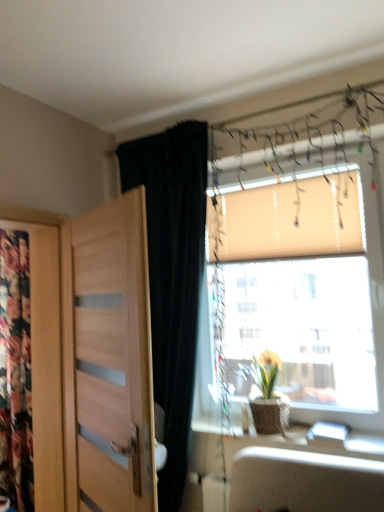
The height and width of the screenshot is (512, 384). I want to click on beige fabric blind at upper right, so [x=291, y=221].

Image resolution: width=384 pixels, height=512 pixels. Describe the element at coordinates (108, 360) in the screenshot. I see `light brown wood door at left` at that location.

Where is `beige fabric blind at upper right`? Image resolution: width=384 pixels, height=512 pixels. beige fabric blind at upper right is located at coordinates (291, 221).

Considering the sizes of objects green leafy plant in woven basket at window and floral fabric at left in the image provided, who is wider, green leafy plant in woven basket at window or floral fabric at left?

With larger width is green leafy plant in woven basket at window.

Is green leafy plant in woven basket at window in contact with floral fabric at left?

No, green leafy plant in woven basket at window is not in contact with floral fabric at left.

Considering the relative sizes of green leafy plant in woven basket at window and floral fabric at left in the image provided, is green leafy plant in woven basket at window shorter than floral fabric at left?

Correct, green leafy plant in woven basket at window is not as tall as floral fabric at left.

From the picture: Which is nearer, [279,406] or [22,384]?

Point [279,406] appears to be closer to the viewer than point [22,384].

Which of these two, floral fabric at left or beige fabric blind at upper right, stands taller?

floral fabric at left.

Would you say beige fabric blind at upper right is part of floral fabric at left's contents?

Actually, beige fabric blind at upper right is outside floral fabric at left.

Considering the points (20, 359) and (264, 258), which point is in front, point (20, 359) or point (264, 258)?

The point (264, 258) is closer.

From the image's perspective, is floral fabric at left positioned above or below wooden blinds at upper right?

floral fabric at left is below wooden blinds at upper right.

Does floral fabric at left contain wooden blinds at upper right?

Definitely not — wooden blinds at upper right is not inside floral fabric at left.

Considering their positions, is floral fabric at left located in front of or behind wooden blinds at upper right?

Visually, floral fabric at left is located behind wooden blinds at upper right.

From the image's perspective, is wooden blinds at upper right beneath light brown wood door at left?

Actually, wooden blinds at upper right appears above light brown wood door at left in the image.

Is wooden blinds at upper right touching light brown wood door at left?

No, wooden blinds at upper right is not next to light brown wood door at left.

Looking at this image, considering the sizes of objects wooden blinds at upper right and light brown wood door at left in the image provided, who is smaller, wooden blinds at upper right or light brown wood door at left?

light brown wood door at left.

From a real-world perspective, which is physically below, wooden blinds at upper right or light brown wood door at left?

light brown wood door at left, from a real-world perspective.

Does light brown wood door at left appear on the right side of black velvet curtain at left?

In fact, light brown wood door at left is to the left of black velvet curtain at left.

Does point (104, 359) appear closer or farther from the camera than point (170, 253)?

Clearly, point (104, 359) is closer to the camera than point (170, 253).

From the image's perspective, which one is positioned higher, light brown wood door at left or black velvet curtain at left?

black velvet curtain at left appears higher in the image.

Identify the location of door below the black velvet curtain at left (from a real-world perspective). Image resolution: width=384 pixels, height=512 pixels. (108, 360).

From a real-world perspective, between beige fabric blind at upper right and black velvet curtain at left, who is vertically higher?

beige fabric blind at upper right, from a real-world perspective.

Are beige fabric blind at upper right and black velvet curtain at left beside each other?

No, beige fabric blind at upper right is not in contact with black velvet curtain at left.

Would you say beige fabric blind at upper right contains black velvet curtain at left?

No, black velvet curtain at left is located outside of beige fabric blind at upper right.

Is beige fabric blind at upper right aimed at black velvet curtain at left?

No, beige fabric blind at upper right does not turn towards black velvet curtain at left.

Is light brown wood door at left located outside wooden blinds at upper right?

Yes, light brown wood door at left is not within wooden blinds at upper right.

Considering the sizes of objects light brown wood door at left and wooden blinds at upper right in the image provided, who is bigger, light brown wood door at left or wooden blinds at upper right?

wooden blinds at upper right is bigger.

From a real-world perspective, is light brown wood door at left under wooden blinds at upper right?

Yes.

Is light brown wood door at left aimed at wooden blinds at upper right?

No, light brown wood door at left is not facing towards wooden blinds at upper right.

This screenshot has width=384, height=512. I want to click on tapestry behind the green leafy plant in woven basket at window, so click(15, 372).

Where is `tapestry on the left of the beige fabric blind at upper right`? The width and height of the screenshot is (384, 512). tapestry on the left of the beige fabric blind at upper right is located at coordinates (15, 372).

When comparing their distances from beige fabric blind at upper right, does wooden blinds at upper right or black velvet curtain at left seem closer?

Among the two, wooden blinds at upper right is located nearer to beige fabric blind at upper right.

Which object lies further to the anchor point green leafy plant in woven basket at window, floral fabric at left or beige fabric blind at upper right?

Based on the image, floral fabric at left appears to be further to green leafy plant in woven basket at window.

When comparing their distances from black velvet curtain at left, does green leafy plant in woven basket at window or light brown wood door at left seem further?

green leafy plant in woven basket at window.

Consider the image. When comparing their distances from wooden blinds at upper right, does black velvet curtain at left or green leafy plant in woven basket at window seem closer?

green leafy plant in woven basket at window.

When comparing their distances from floral fabric at left, does light brown wood door at left or black velvet curtain at left seem closer?

Among the two, light brown wood door at left is located nearer to floral fabric at left.

Based on their spatial positions, is light brown wood door at left or green leafy plant in woven basket at window closer to beige fabric blind at upper right?

green leafy plant in woven basket at window is closer to beige fabric blind at upper right.

Which object lies further to the anchor point beige fabric blind at upper right, black velvet curtain at left or light brown wood door at left?

Among the two, light brown wood door at left is located further to beige fabric blind at upper right.

Looking at the image, which one is located closer to wooden blinds at upper right, green leafy plant in woven basket at window or black velvet curtain at left?

green leafy plant in woven basket at window.

I want to click on curtain between light brown wood door at left and beige fabric blind at upper right, so click(172, 276).

The image size is (384, 512). Identify the location of blind located between black velvet curtain at left and wooden blinds at upper right in the left-right direction. (291, 221).

Find the location of `curtain between light brown wood door at left and floral fabric at left along the z-axis`. curtain between light brown wood door at left and floral fabric at left along the z-axis is located at coordinates (172, 276).

Identify the location of curtain between floral fabric at left and beige fabric blind at upper right. The height and width of the screenshot is (512, 384). pyautogui.click(x=172, y=276).